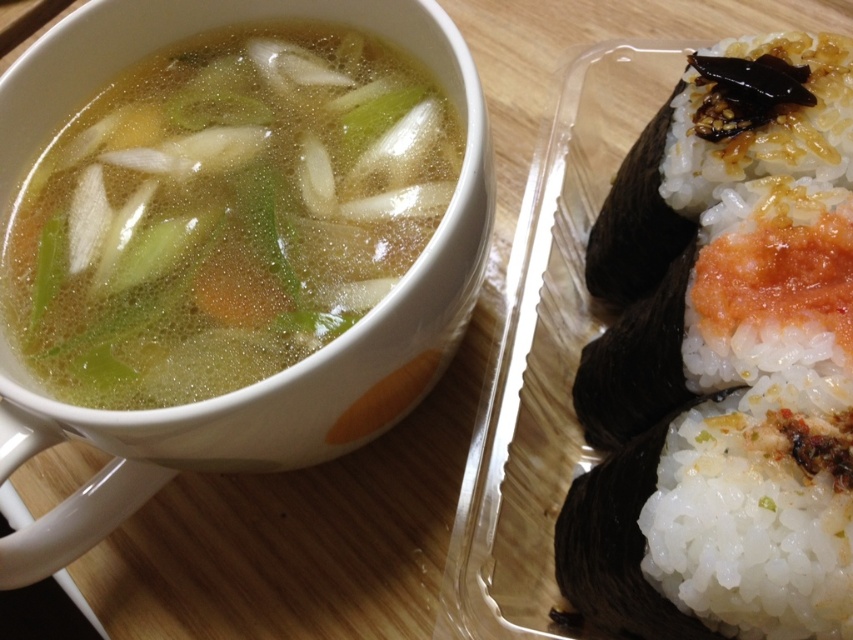
Question: Does white rice with nori at right appear on the left side of white rice at upper right?

Choices:
 (A) no
 (B) yes

Answer: (A)

Question: Which point is farther to the camera?

Choices:
 (A) (747, 260)
 (B) (90, 356)
 (C) (764, 438)

Answer: (B)

Question: Can you confirm if translucent broth at upper left is positioned above white rice at upper right?

Choices:
 (A) yes
 (B) no

Answer: (A)

Question: Observing the image, what is the correct spatial positioning of translucent broth at upper left in reference to white rice at upper right?

Choices:
 (A) above
 (B) below

Answer: (A)

Question: Which of these objects is positioned closest to the translucent broth at upper left?

Choices:
 (A) white rice with nori at right
 (B) white rice at upper right

Answer: (A)

Question: Which object is the farthest from the white rice at upper right?

Choices:
 (A) translucent broth at upper left
 (B) white rice with nori at right

Answer: (A)